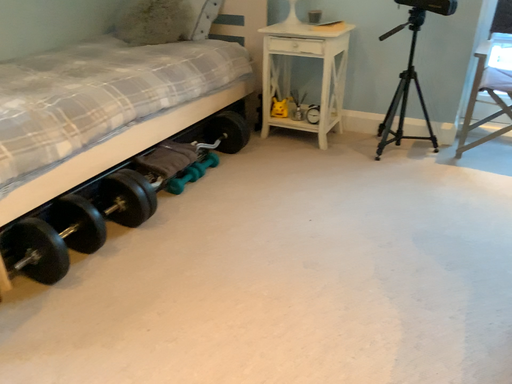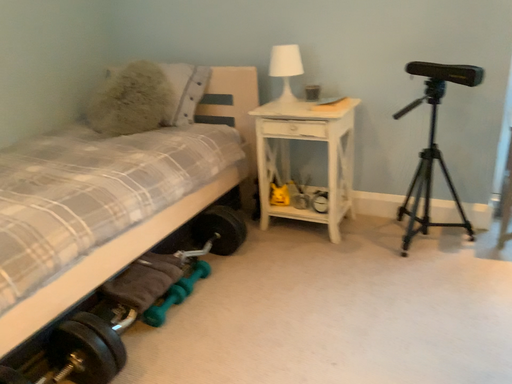
Question: Which way did the camera rotate in the video?

Choices:
 (A) rotated downward
 (B) rotated upward

Answer: (B)